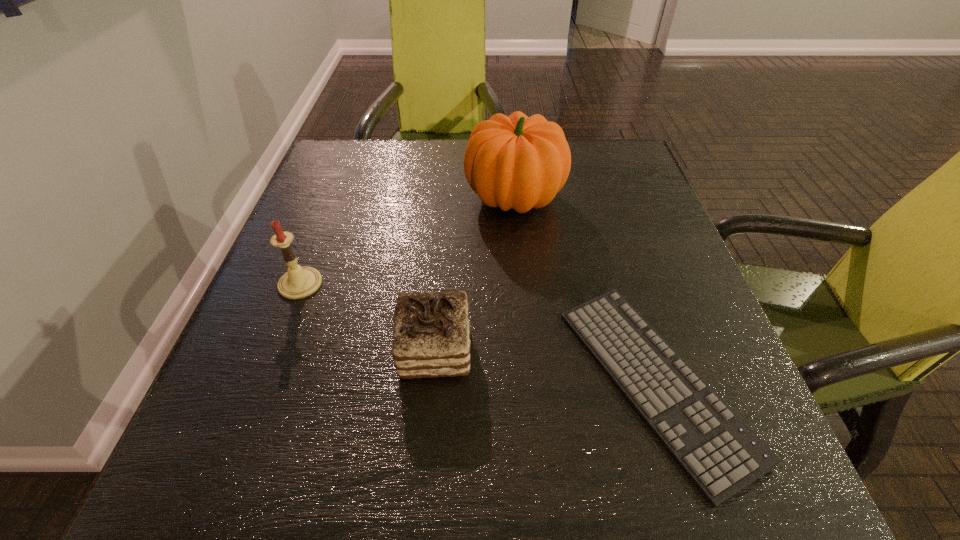
Locate an element on the screen. The height and width of the screenshot is (540, 960). free location at the far right corner is located at coordinates (577, 147).

The image size is (960, 540). I want to click on vacant space in between the tallest object and the leftmost object, so click(407, 241).

Locate an element on the screen. Image resolution: width=960 pixels, height=540 pixels. vacant space in between the tallest object and the computer keyboard is located at coordinates (585, 290).

You are a GUI agent. You are given a task and a screenshot of the screen. Output one action in this format:
    pyautogui.click(x=<x>, y=<y>)
    Task: Click on the free space between the chocolate cake and the pumpkin
    
    Given the screenshot: What is the action you would take?
    pyautogui.click(x=474, y=274)

The image size is (960, 540). What are the coordinates of `free space that is in between the farthest object and the chocolate cake` in the screenshot? It's located at [x=474, y=274].

This screenshot has width=960, height=540. I want to click on vacant region between the computer keyboard and the pumpkin, so click(x=585, y=290).

Image resolution: width=960 pixels, height=540 pixels. I want to click on free space that is in between the computer keyboard and the pumpkin, so click(585, 290).

You are a GUI agent. You are given a task and a screenshot of the screen. Output one action in this format:
    pyautogui.click(x=<x>, y=<y>)
    Task: Click on the free spot between the candle and the farthest object
    
    Given the screenshot: What is the action you would take?
    pyautogui.click(x=407, y=241)

This screenshot has width=960, height=540. Identify the location of free space between the pumpkin and the chocolate cake. (474, 274).

In order to click on free space between the shortest object and the candle in this screenshot , I will do `click(478, 333)`.